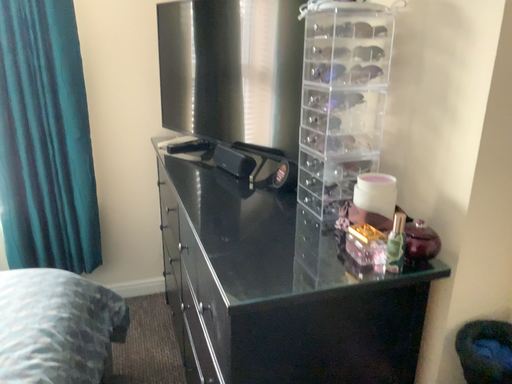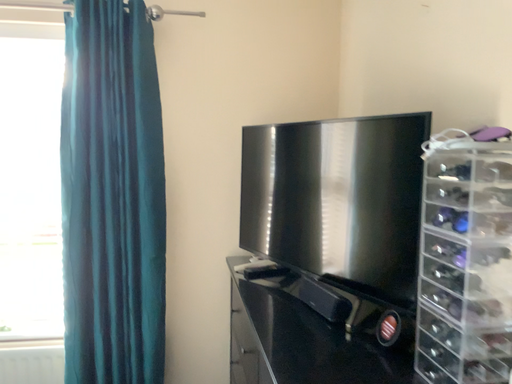
Question: How did the camera likely rotate when shooting the video?

Choices:
 (A) rotated downward
 (B) rotated upward

Answer: (B)